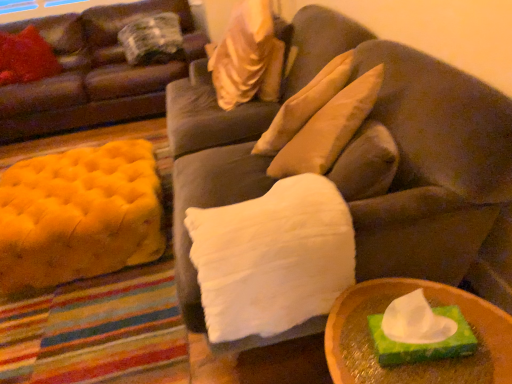
Question: Considering their positions, is white fluffy pillow at center, placed as the 4th pillow when sorted from back to front, located in front of or behind velvety red pillow at upper left, marked as the 1th pillow in a left-to-right arrangement?

Choices:
 (A) front
 (B) behind

Answer: (A)

Question: In terms of width, does white fluffy pillow at center, which is the 1th pillow in right-to-left order, look wider or thinner when compared to velvety red pillow at upper left, which is counted as the 3th pillow, starting from the front?

Choices:
 (A) wide
 (B) thin

Answer: (A)

Question: Which is nearer to the plaid fabric pillow at upper left, which is the 1th pillow in back-to-front order?

Choices:
 (A) velvet brown couch at center, which is the first studio couch from right to left
 (B) white fluffy pillow at center, which is the 1th pillow in right-to-left order
 (C) velvety red pillow at upper left, which is the fourth pillow in right-to-left order
 (D) velvet brown couch at upper left, which is the 2th studio couch in right-to-left order
 (E) satin beige pillow at upper center, which is the 2th pillow in right-to-left order

Answer: (D)

Question: Which of these objects is positioned farthest from the velvet brown couch at upper left, which is the 2th studio couch in right-to-left order?

Choices:
 (A) yellow tufted ottoman at left
 (B) velvet brown couch at center, marked as the second studio couch in a left-to-right arrangement
 (C) wooden tray at lower right
 (D) white fluffy pillow at center, placed as the 1th pillow when sorted from front to back
 (E) satin beige pillow at upper center, marked as the 2th pillow in a front-to-back arrangement

Answer: (C)